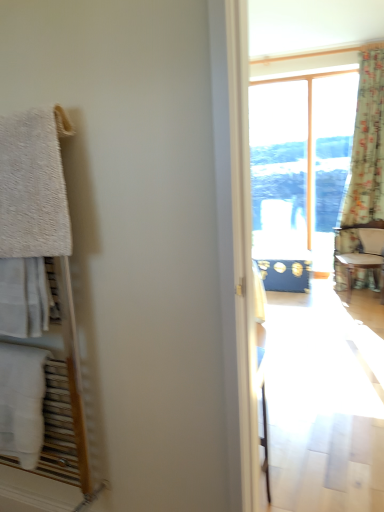
Question: Could you tell me if white fluffy towel at left, placed as the 2th towel/napkin when sorted from bottom to top, is facing white cotton towel at left, the first towel/napkin when ordered from bottom to top?

Choices:
 (A) yes
 (B) no

Answer: (B)

Question: Is white fluffy towel at left, placed as the first towel/napkin when sorted from top to bottom, to the right of white cotton towel at left, the first towel/napkin when ordered from bottom to top, from the viewer's perspective?

Choices:
 (A) no
 (B) yes

Answer: (B)

Question: Is white fluffy towel at left, placed as the first towel/napkin when sorted from top to bottom, completely or partially outside of white cotton towel at left, the second towel/napkin when ordered from top to bottom?

Choices:
 (A) yes
 (B) no

Answer: (A)

Question: Does white fluffy towel at left, placed as the first towel/napkin when sorted from top to bottom, have a greater height compared to white cotton towel at left, the second towel/napkin when ordered from top to bottom?

Choices:
 (A) no
 (B) yes

Answer: (B)

Question: Is white fluffy towel at left, placed as the first towel/napkin when sorted from top to bottom, closer to camera compared to white cotton towel at left, the second towel/napkin when ordered from top to bottom?

Choices:
 (A) yes
 (B) no

Answer: (A)

Question: Looking at the image, does wooden textured chair at right seem bigger or smaller compared to white cotton towel at left, the first towel/napkin when ordered from bottom to top?

Choices:
 (A) small
 (B) big

Answer: (B)

Question: From the image's perspective, is wooden textured chair at right above or below white cotton towel at left, the second towel/napkin when ordered from top to bottom?

Choices:
 (A) above
 (B) below

Answer: (A)

Question: Considering the positions of wooden textured chair at right and white cotton towel at left, the first towel/napkin when ordered from bottom to top, in the image, is wooden textured chair at right taller or shorter than white cotton towel at left, the first towel/napkin when ordered from bottom to top,?

Choices:
 (A) tall
 (B) short

Answer: (A)

Question: Considering their positions, is wooden textured chair at right located in front of or behind white cotton towel at left, the first towel/napkin when ordered from bottom to top?

Choices:
 (A) behind
 (B) front

Answer: (A)

Question: Considering the positions of wooden textured chair at right and floral fabric curtain at right in the image, is wooden textured chair at right taller or shorter than floral fabric curtain at right?

Choices:
 (A) tall
 (B) short

Answer: (B)

Question: From the image's perspective, is wooden textured chair at right located above or below floral fabric curtain at right?

Choices:
 (A) above
 (B) below

Answer: (B)

Question: Is wooden textured chair at right inside or outside of floral fabric curtain at right?

Choices:
 (A) inside
 (B) outside

Answer: (A)

Question: Considering the positions of point (336, 245) and point (372, 72), is point (336, 245) closer or farther from the camera than point (372, 72)?

Choices:
 (A) farther
 (B) closer

Answer: (A)

Question: Choose the correct answer: Is white fluffy towel at left, placed as the first towel/napkin when sorted from top to bottom, inside wooden textured chair at right or outside it?

Choices:
 (A) outside
 (B) inside

Answer: (A)

Question: From the image's perspective, relative to wooden textured chair at right, is white fluffy towel at left, placed as the first towel/napkin when sorted from top to bottom, above or below?

Choices:
 (A) below
 (B) above

Answer: (B)